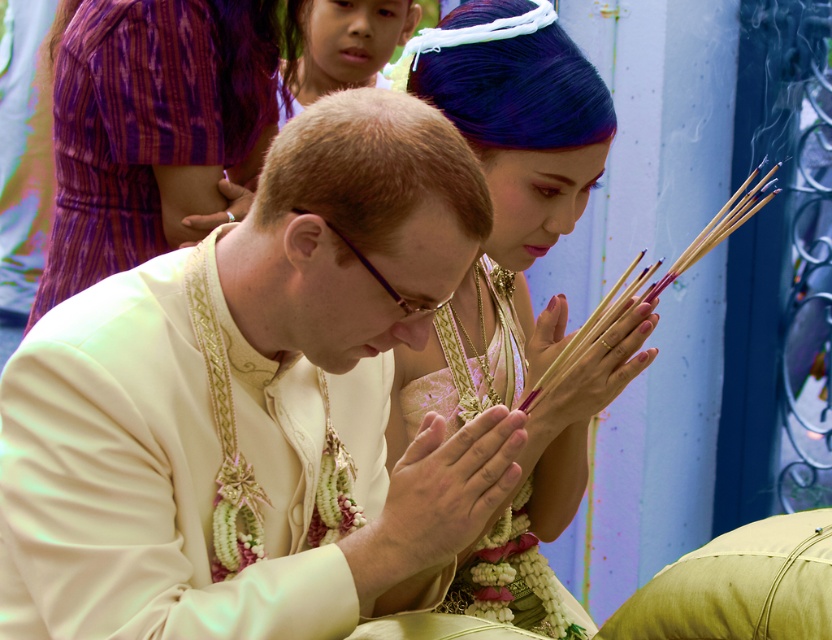
Can you confirm if matte yellow robe at left is shorter than smooth wood incense sticks at center?

Incorrect, matte yellow robe at left's height does not fall short of smooth wood incense sticks at center's.

Which is in front, point (102, 138) or point (566, 346)?

Point (566, 346) is more forward.

Is point (186, 8) positioned in front of point (572, 342)?

No.

Locate an element on the screen. The image size is (832, 640). matte yellow robe at left is located at coordinates point(154,131).

Can you confirm if wooden sticks at center is thinner than smooth wood incense sticks at center?

In fact, wooden sticks at center might be wider than smooth wood incense sticks at center.

Who is more distant from viewer, (x=627, y=273) or (x=536, y=385)?

The point (x=627, y=273) is behind.

Which is behind, point (722, 204) or point (607, 317)?

Point (722, 204)

Locate an element on the screen. wooden sticks at center is located at coordinates (655, 280).

Which is above, matte cream suit at center or silky white dress at center?

matte cream suit at center is above.

Who is taller, matte cream suit at center or silky white dress at center?

With more height is matte cream suit at center.

Describe the element at coordinates (255, 404) in the screenshot. This screenshot has width=832, height=640. I see `matte cream suit at center` at that location.

Image resolution: width=832 pixels, height=640 pixels. I want to click on matte cream suit at center, so tap(255, 404).